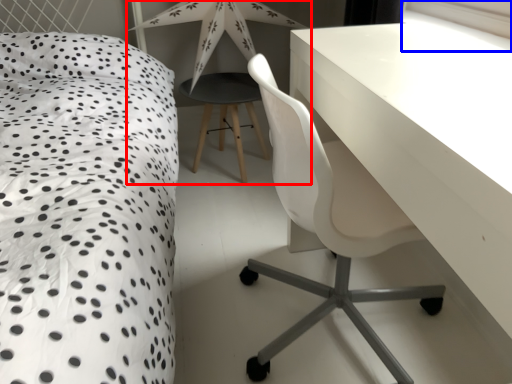
Question: Which point is further to the camera, table lamp (highlighted by a red box) or window screen (highlighted by a blue box)?

Choices:
 (A) table lamp
 (B) window screen

Answer: (A)